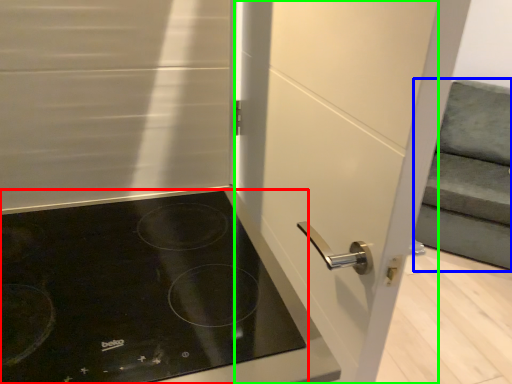
Question: Which object is the farthest from gas stove (highlighted by a red box)? Choose among these: armchair (highlighted by a blue box) or screen door (highlighted by a green box).

Choices:
 (A) armchair
 (B) screen door

Answer: (A)